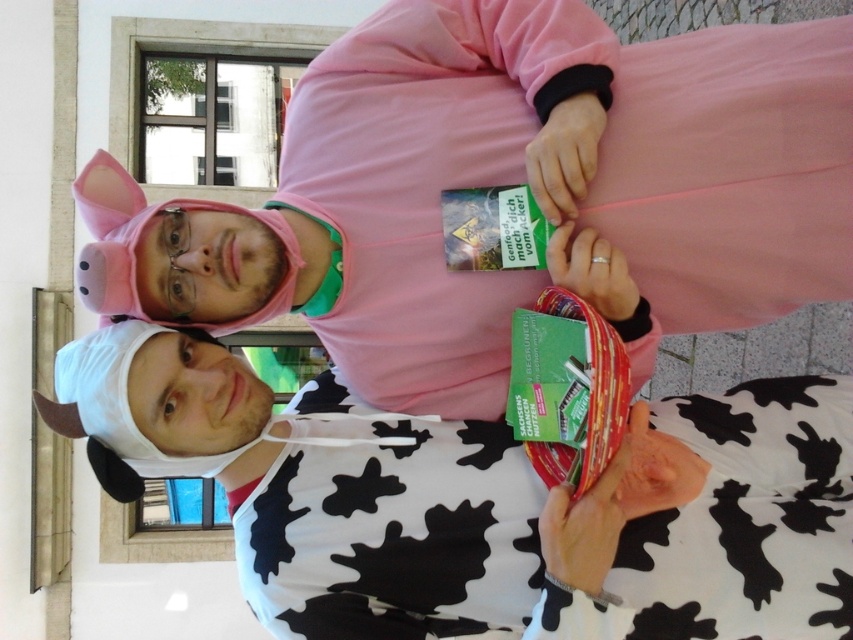
You are standing in front of the building with large windows and see the two costumed individuals. There is a point at coordinates [503,188]. Which object from the scene does this point lie on?

The point at coordinates [503,188] lies on the pink fleece at upper center.

You are a photographer trying to capture both the pink fleece at upper center and the white cow print hoodie at center in a single shot. Which one do you need to focus on first to ensure it is in sharp focus?

The pink fleece at upper center is further to the viewer than the white cow print hoodie at center, so you should focus on the pink fleece at upper center first to ensure it is in sharp focus.

You are a photographer trying to capture a clear shot of both the pink fleece at upper center and the white cow print hoodie at center. Based on their positions, which one is positioned higher in the frame?

The pink fleece at upper center is positioned higher in the frame than the white cow print hoodie at center.